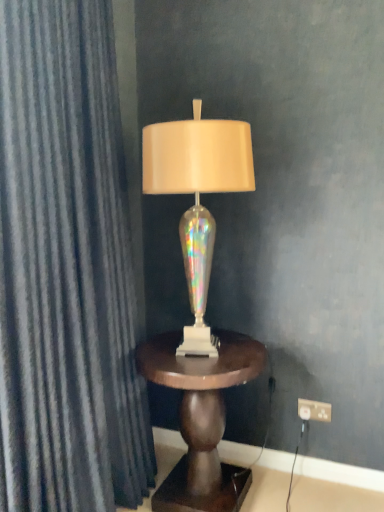
Question: Are mahogany wood side table at center and iridescent glass lamp at center located far from each other?

Choices:
 (A) no
 (B) yes

Answer: (A)

Question: From a real-world perspective, does mahogany wood side table at center stand above iridescent glass lamp at center?

Choices:
 (A) yes
 (B) no

Answer: (B)

Question: From the image's perspective, is mahogany wood side table at center over iridescent glass lamp at center?

Choices:
 (A) no
 (B) yes

Answer: (A)

Question: Does mahogany wood side table at center come in front of iridescent glass lamp at center?

Choices:
 (A) yes
 (B) no

Answer: (B)

Question: Is iridescent glass lamp at center completely or partially inside mahogany wood side table at center?

Choices:
 (A) yes
 (B) no

Answer: (B)

Question: From their relative heights in the image, would you say iridescent glass lamp at center is taller or shorter than white plastic outlet at lower right?

Choices:
 (A) tall
 (B) short

Answer: (A)

Question: Is iridescent glass lamp at center in front of or behind white plastic outlet at lower right in the image?

Choices:
 (A) front
 (B) behind

Answer: (A)

Question: Is iridescent glass lamp at center to the left or to the right of white plastic outlet at lower right in the image?

Choices:
 (A) right
 (B) left

Answer: (B)

Question: In terms of size, does iridescent glass lamp at center appear bigger or smaller than white plastic outlet at lower right?

Choices:
 (A) big
 (B) small

Answer: (A)

Question: In the image, is white plastic outlet at lower right positioned in front of or behind mahogany wood side table at center?

Choices:
 (A) behind
 (B) front

Answer: (A)

Question: Looking at the image, does white plastic outlet at lower right seem bigger or smaller compared to mahogany wood side table at center?

Choices:
 (A) small
 (B) big

Answer: (A)

Question: Considering the relative positions of white plastic outlet at lower right and mahogany wood side table at center in the image provided, is white plastic outlet at lower right to the left or to the right of mahogany wood side table at center?

Choices:
 (A) right
 (B) left

Answer: (A)

Question: From a real-world perspective, is white plastic outlet at lower right above or below mahogany wood side table at center?

Choices:
 (A) above
 (B) below

Answer: (B)

Question: Considering the positions of dark blue textured curtain at left and white plastic outlet at lower right in the image, is dark blue textured curtain at left bigger or smaller than white plastic outlet at lower right?

Choices:
 (A) small
 (B) big

Answer: (B)

Question: From the image's perspective, relative to white plastic outlet at lower right, is dark blue textured curtain at left above or below?

Choices:
 (A) above
 (B) below

Answer: (A)